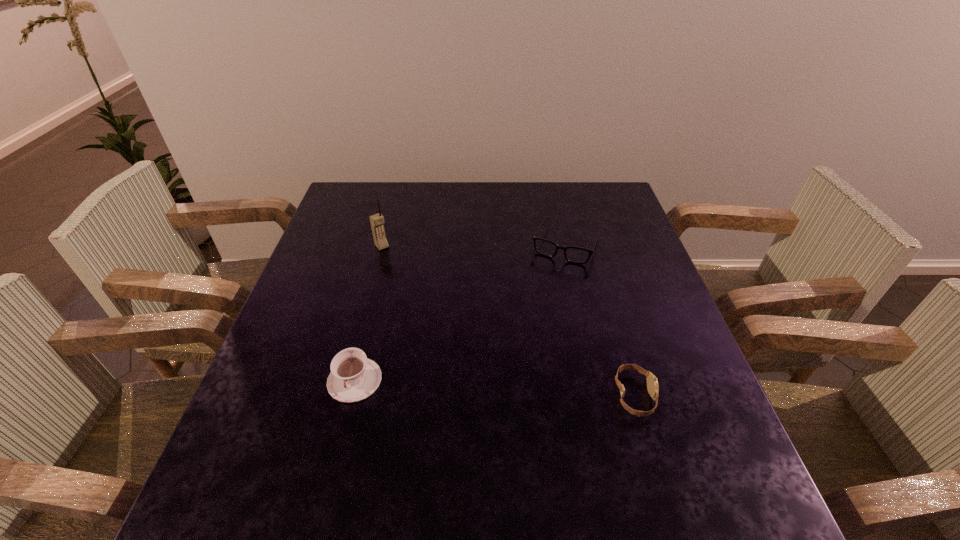
Identify the location of free region located on the front of the cellular telephone, where the keypad is located. The width and height of the screenshot is (960, 540). (454, 329).

Locate an element on the screen. The image size is (960, 540). object located in the near edge section of the desktop is located at coordinates (652, 383).

Find the location of a particular element. The width and height of the screenshot is (960, 540). teacup that is at the left edge is located at coordinates [354, 377].

I want to click on cellular telephone positioned at the left edge, so click(377, 221).

What are the coordinates of `watch that is at the right edge` in the screenshot? It's located at [x=652, y=383].

This screenshot has height=540, width=960. Find the location of `spectacles present at the right edge`. spectacles present at the right edge is located at coordinates (577, 255).

Find the location of `object positioned at the near right corner`. object positioned at the near right corner is located at coordinates (652, 383).

The image size is (960, 540). Find the location of `free spot at the far edge of the desktop`. free spot at the far edge of the desktop is located at coordinates coord(576,222).

The height and width of the screenshot is (540, 960). Find the location of `vacant space at the near edge of the desktop`. vacant space at the near edge of the desktop is located at coordinates (577, 422).

At what (x,y) coordinates should I click in order to perform the action: click on free space at the left edge. Please return your answer as a coordinate pair (x, y). Looking at the image, I should click on (253, 396).